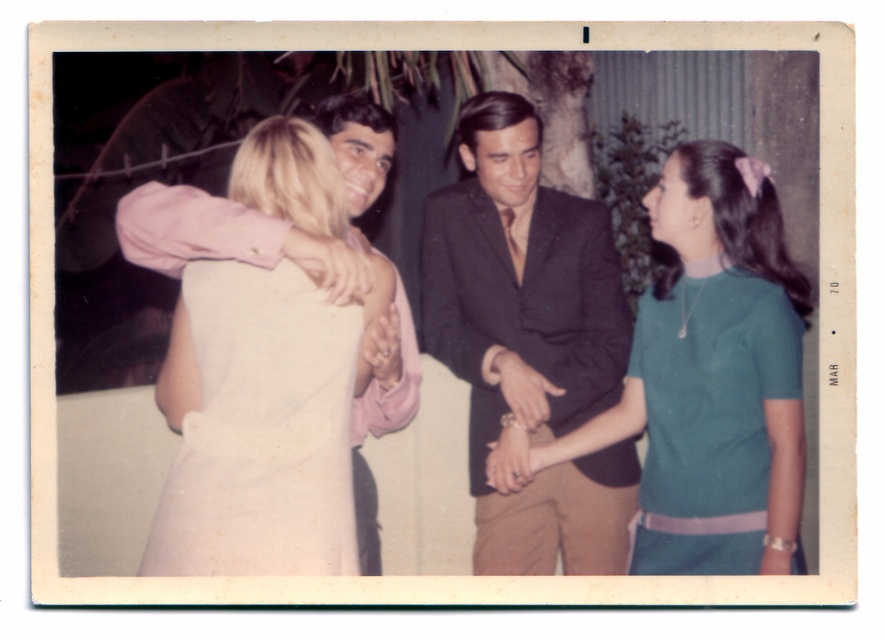
You are organizing a photo shoot and need to arrange two outfits in the center of the frame. The outfits are the dark brown suit at center and the green knit dress at center. Based on their sizes, which outfit should you place first to ensure both fit comfortably in the center?

The dark brown suit at center occupies less space than the green knit dress at center, so you should place the green knit dress at center first to accommodate its larger size, leaving enough space for the dark brown suit at center.

You are a photographer trying to capture a group photo of the green knit dress at center and the light pink fabric dress at center. Since you want to ensure both are fully visible in the frame, which dress should you position closer to the camera to avoid cropping?

The green knit dress at center is much taller than the light pink fabric dress at center, so positioning the green knit dress at center closer to the camera will ensure both are fully visible without cropping.

You are a photographer at this event and want to capture a photo that includes both the teal knitted dress at right and the light pink fabric dress at center. Based on their positions, which dress should be placed closer to the camera to ensure both are fully visible in the frame?

The teal knitted dress at right is positioned under the light pink fabric dress at center. To ensure both are fully visible, the light pink fabric dress at center should be closer to the camera so that the teal knitted dress at right isn not blocked by it.